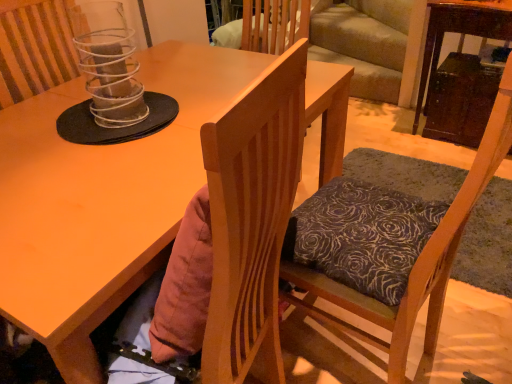
Where is `free space to the right of clear plastic spiral at upper center`? This screenshot has height=384, width=512. free space to the right of clear plastic spiral at upper center is located at coordinates (196, 110).